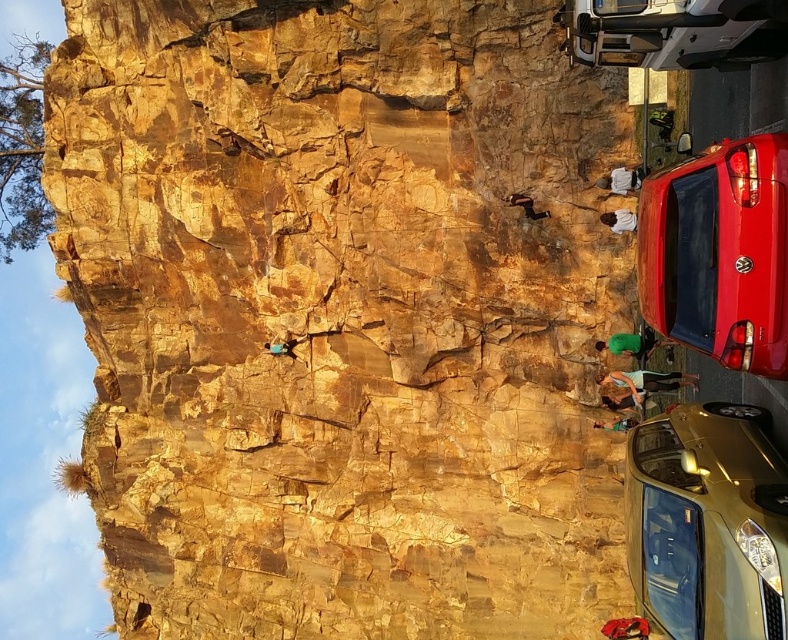
Question: Which object appears closest to the camera in this image?

Choices:
 (A) gold metallic car at lower right
 (B) green fabric rock climber at center
 (C) metallic silver van at upper right
 (D) shiny red car at right

Answer: (A)

Question: Is metallic silver van at upper right wider than smooth skin rock climber at lower right?

Choices:
 (A) yes
 (B) no

Answer: (A)

Question: Considering the relative positions of smooth skin rock climber at lower right and green fabric rock climber at center in the image provided, where is smooth skin rock climber at lower right located with respect to green fabric rock climber at center?

Choices:
 (A) left
 (B) right

Answer: (B)

Question: Which of the following is the farthest from the observer?

Choices:
 (A) (652, 64)
 (B) (734, 156)

Answer: (A)

Question: Among these points, which one is farthest from the camera?

Choices:
 (A) (712, 620)
 (B) (645, 342)
 (C) (708, 259)

Answer: (B)

Question: Is gold metallic car at lower right positioned at the back of shiny red car at right?

Choices:
 (A) yes
 (B) no

Answer: (B)